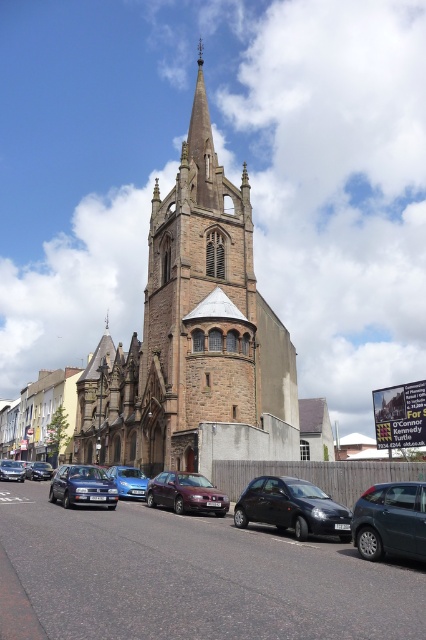
You are a pedestrian standing on the sidewalk in front of the historic stone church with a pointed spire. You see a satin burgundy sedan at center and a matte black car at center. Which car is positioned more to the right side?

The satin burgundy sedan at center is positioned more to the right side than the matte black car at center.

You are standing at the entrance of the historic stone church with a pointed spire. You want to take a photo of the point at coordinate point (121, 493). The camera you are using has a maximum focus range of 50 meters. Will you be able to focus on that point with your current camera settings?

The distance of point (121, 493) from the camera is 53.60 meters, which exceeds the camera maximum focus range of 50 meters. You will not be able to focus on that point with your current camera settings.

You are a delivery person trying to park your van that is 2 meters tall. You see the satin burgundy sedan at center and the matte black car at center in front of the church. Which car is taller and could block your van from passing through the narrow alley behind them?

The satin burgundy sedan at center is much taller than the matte black car at center, so it could block the van from passing through the narrow alley behind them.